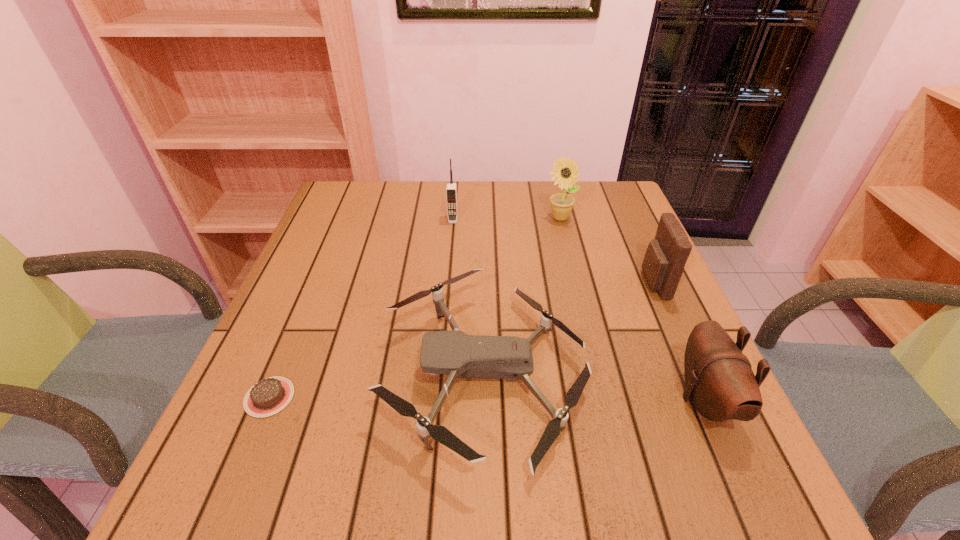
Locate an element on the screen. This screenshot has height=540, width=960. free space located with an open flap on the farther pouch is located at coordinates (553, 282).

Locate an element on the screen. Image resolution: width=960 pixels, height=540 pixels. vacant space located with an open flap on the farther pouch is located at coordinates (532, 282).

Find the location of `vacant space located 0.180m with the flap open on the nearer pouch`. vacant space located 0.180m with the flap open on the nearer pouch is located at coordinates (582, 400).

The image size is (960, 540). In order to click on vacant region located 0.110m with the flap open on the nearer pouch in this screenshot , I will do `click(620, 400)`.

Where is `free region located with the flap open on the nearer pouch`? This screenshot has width=960, height=540. free region located with the flap open on the nearer pouch is located at coordinates (532, 400).

What are the coordinates of `vacant space located 0.170m on the front-facing side of the second shortest object` in the screenshot? It's located at pyautogui.click(x=294, y=374).

Locate an element on the screen. vacant space located 0.050m on the front-facing side of the second shortest object is located at coordinates (356, 374).

This screenshot has width=960, height=540. In order to click on free region located on the front-facing side of the second shortest object in this screenshot , I will do `click(330, 374)`.

The image size is (960, 540). I want to click on vacant space located 0.230m on the back of the shortest object, so click(x=312, y=294).

Find the location of a particular element. The width and height of the screenshot is (960, 540). sunflower present at the far edge is located at coordinates (565, 173).